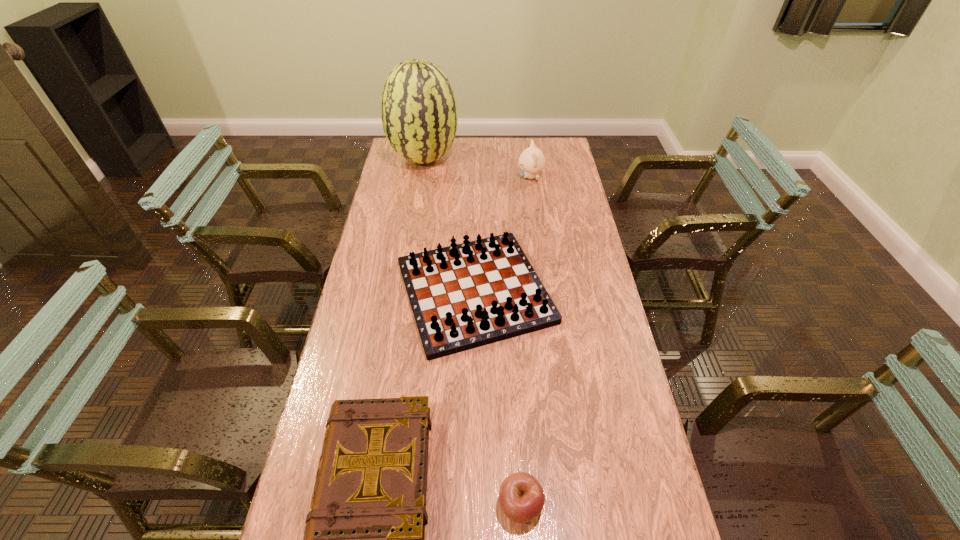
I want to click on the tallest object, so click(x=419, y=114).

You are a GUI agent. You are given a task and a screenshot of the screen. Output one action in this format:
    pyautogui.click(x=<x>, y=<y>)
    Task: Click on the second tallest object
    The width and height of the screenshot is (960, 540).
    Given the screenshot: What is the action you would take?
    531,161

The width and height of the screenshot is (960, 540). In order to click on chessboard in this screenshot , I will do `click(463, 296)`.

The image size is (960, 540). I want to click on the third farthest object, so click(x=463, y=296).

Find the location of a particular element. Image resolution: width=960 pixels, height=540 pixels. apple is located at coordinates (521, 497).

Identify the location of free space located on the right of the watermelon. (526, 159).

Identify the location of free space located 0.070m on the face of the kitten. 502,177.

Locate an element on the screen. free space located on the face of the kitten is located at coordinates (497, 177).

The width and height of the screenshot is (960, 540). I want to click on vacant area located on the face of the kitten, so click(x=497, y=177).

Where is `vacant space situated on the back of the third tallest object`? vacant space situated on the back of the third tallest object is located at coordinates (475, 225).